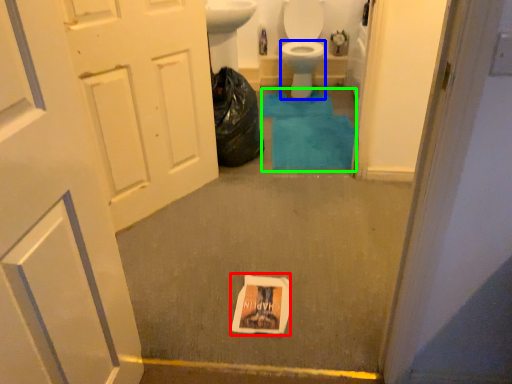
Question: Which object is positioned closest to flyer (highlighted by a red box)? Select from bidet (highlighted by a blue box) and bath mat (highlighted by a green box).

Choices:
 (A) bidet
 (B) bath mat

Answer: (B)